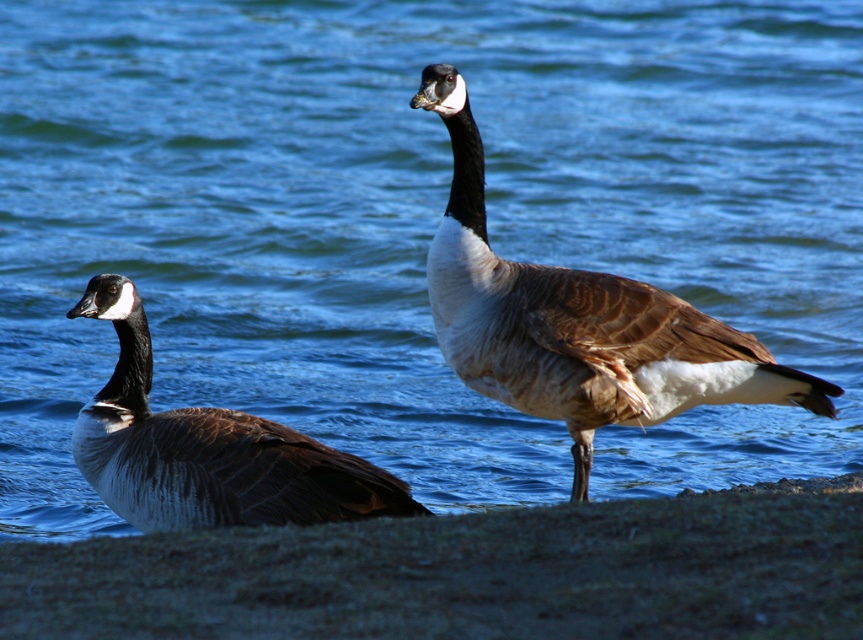
Question: Which object is closer to the camera taking this photo?

Choices:
 (A) brown feathered goose at center
 (B) sandy shore at lower left
 (C) brown feathered duck at left

Answer: (B)

Question: Does brown feathered goose at center have a larger size compared to brown feathered duck at left?

Choices:
 (A) no
 (B) yes

Answer: (B)

Question: Where is brown feathered goose at center located in relation to brown feathered duck at left in the image?

Choices:
 (A) below
 (B) above

Answer: (B)

Question: Based on their relative distances, which object is nearer to the brown feathered duck at left?

Choices:
 (A) sandy shore at lower left
 (B) brown feathered goose at center

Answer: (B)

Question: Among these objects, which one is nearest to the camera?

Choices:
 (A) brown feathered goose at center
 (B) sandy shore at lower left
 (C) brown feathered duck at left

Answer: (B)

Question: Can you confirm if sandy shore at lower left is bigger than brown feathered goose at center?

Choices:
 (A) yes
 (B) no

Answer: (B)